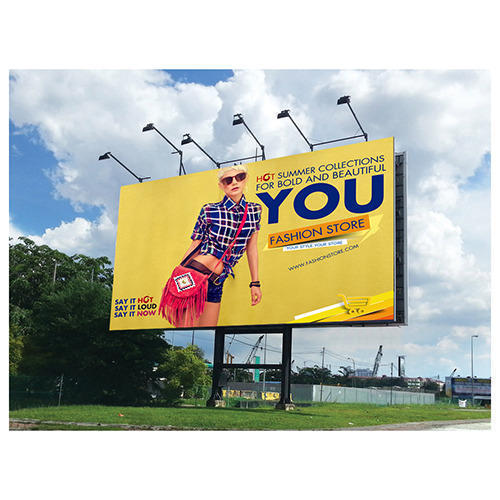
Where is `"fashion store"`? "fashion store" is located at coordinates (290, 233), (319, 231), (346, 226).